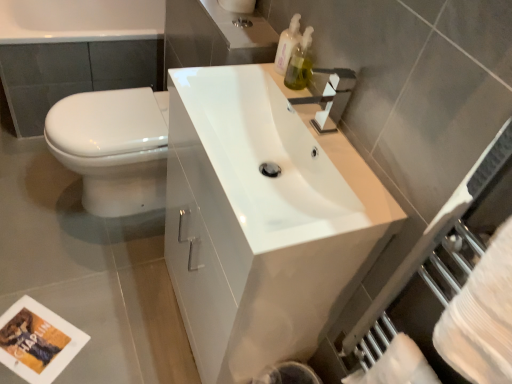
Locate an element on the screen. This screenshot has height=384, width=512. free location in front of white glossy toilet at left is located at coordinates (80, 258).